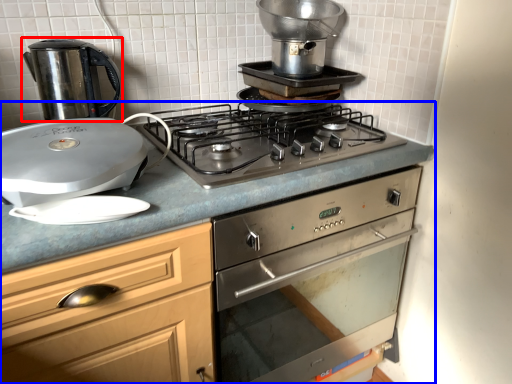
Question: Which object appears farthest to the camera in this image, kitchen appliance (highlighted by a red box) or countertop (highlighted by a blue box)?

Choices:
 (A) kitchen appliance
 (B) countertop

Answer: (A)